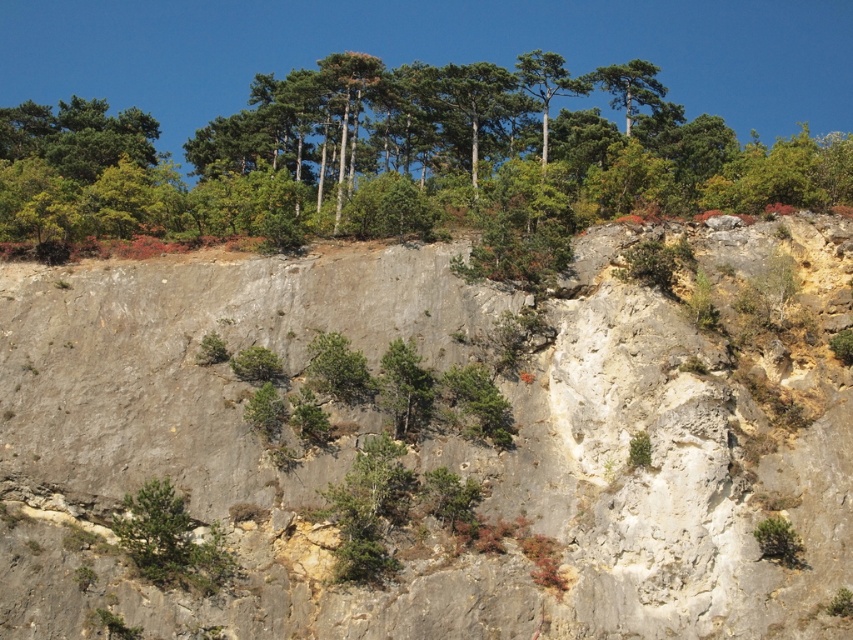
Question: Is gray rock at center smaller than green leafy shrub at lower left?

Choices:
 (A) no
 (B) yes

Answer: (A)

Question: Which point is closer to the camera?

Choices:
 (A) (779, 563)
 (B) (155, 576)
 (C) (236, 164)

Answer: (A)

Question: Which object is positioned farthest from the gray rock at center?

Choices:
 (A) green leafy trees at upper center
 (B) green leafy shrub at lower left

Answer: (A)

Question: Is gray rock at center further to camera compared to green leafy trees at upper center?

Choices:
 (A) no
 (B) yes

Answer: (A)

Question: Which object is the farthest from the green leafy shrub at lower left?

Choices:
 (A) green leafy trees at upper center
 (B) gray rock at center

Answer: (A)

Question: Does gray rock at center come behind green leafy trees at upper center?

Choices:
 (A) no
 (B) yes

Answer: (A)